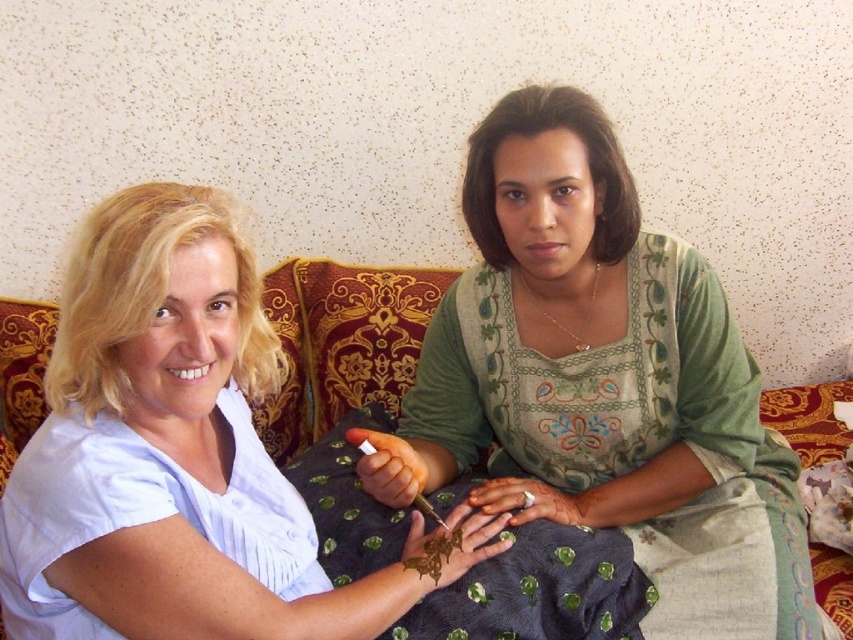
You are a fashion designer observing two outfits in the image. The green embroidered dress at center and the matte white blouse at left are both on display. Which outfit has a wider silhouette?

The green embroidered dress at center is wider than the matte white blouse at left, so the green embroidered dress at center has a wider silhouette.

Looking at this image, you are standing in front of the sofa where the two people are sitting. There are two points marked in the image. The first point is at coordinate point (527, 164) and the second point is at coordinate point (206, 568). If you want to reach both points by moving forward, which point will you reach first?

You will reach point (527, 164) first because it is closer to you than point (206, 568), which is further away.

You are a photographer setting up for a group photo. You want to ensure that both the green embroidered dress at center and the matte white blouse at left are clearly visible in the frame. Based on their positions, which one might be partially obscured and why?

The matte white blouse at left might be partially obscured because it is positioned behind the green embroidered dress at center, potentially blocking part of it from view.